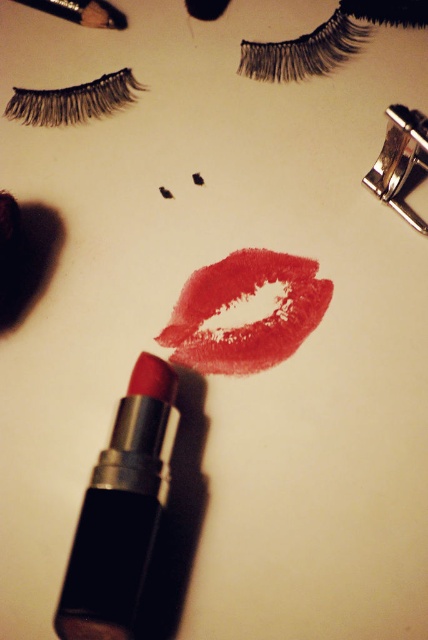
You are a makeup artist preparing a client for a glamorous look. You need to place the black synthetic false eyelashes at upper left and the metallic silver brush at upper left on the table. According to the image, which object is positioned to the left of the other?

The metallic silver brush at upper left is to the left of the black synthetic false eyelashes at upper left because the black synthetic false eyelashes at upper left are to the right of the metallic silver brush at upper left.

You are a makeup artist who needs to reach for the shiny red lipstick at center and the metallic silver brush at upper left while keeping your arms within a 25 inch reach. Can you comfortably reach both items without moving your arms?

The shiny red lipstick at center and the metallic silver brush at upper left are 28.16 inches apart from each other. Since the distance exceeds your 25 inch reach, you cannot comfortably reach both items without moving your arms.

You are a makeup artist who needs to place a 50 cm long eyeliner pencil between the shiny red lipstick at center and the black synthetic false eyelashes at upper left. Can the eyeliner pencil fit in the space between them?

The distance between the shiny red lipstick at center and the black synthetic false eyelashes at upper left is 53.00 centimeters, so the 50 cm eyeliner pencil can fit in the space between them.